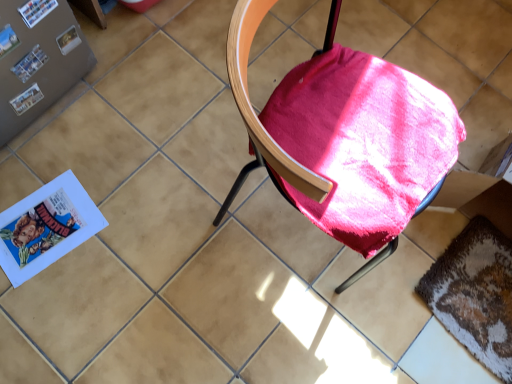
Question: Is velvet-like pink cushion at center bigger or smaller than matte plastic paperback book at upper left, the 1th paperback book when ordered from back to front?

Choices:
 (A) big
 (B) small

Answer: (A)

Question: Is velvet-like pink cushion at center inside or outside of matte plastic paperback book at upper left, the 1th paperback book when ordered from back to front?

Choices:
 (A) outside
 (B) inside

Answer: (A)

Question: Which of these objects is positioned farthest from the velvet-like pink cushion at center?

Choices:
 (A) textured brown mat at lower right
 (B) matte plastic paperback book at upper left, the 1th paperback book when ordered from back to front
 (C) matte paper paperback book at upper left, which is the 1th paperback book in top-to-bottom order

Answer: (B)

Question: Which of these objects is positioned farthest from the matte plastic paperback book at upper left, acting as the 2th paperback book starting from the front?

Choices:
 (A) velvet-like pink cushion at center
 (B) textured brown mat at lower right
 (C) matte paper paperback book at upper left, arranged as the 2th paperback book when viewed from the back

Answer: (B)